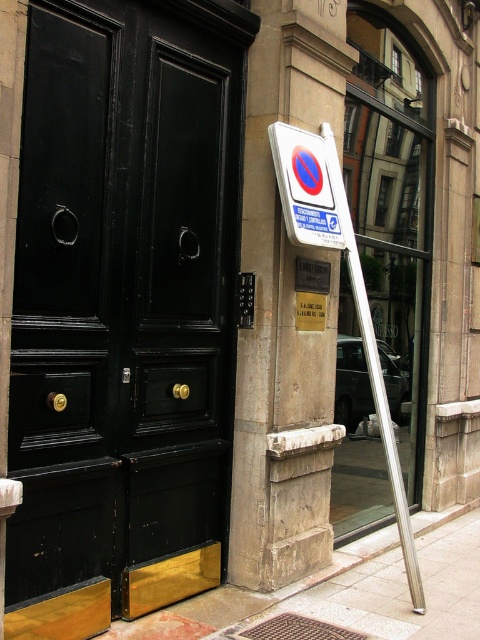
Question: Which point is closer to the camera taking this photo?

Choices:
 (A) (335, 152)
 (B) (312, 243)
 (C) (310, 42)
 (D) (20, 449)

Answer: (D)

Question: Does stone pillar at center have a greater width compared to smooth concrete sidewalk at lower center?

Choices:
 (A) no
 (B) yes

Answer: (A)

Question: Can you confirm if black polished wood door at center is positioned to the right of smooth concrete sidewalk at lower center?

Choices:
 (A) yes
 (B) no

Answer: (B)

Question: Which point is farther from the camera taking this photo?

Choices:
 (A) (81, 536)
 (B) (283, 182)
 (C) (432, 602)

Answer: (C)

Question: Which of the following is the closest to the observer?

Choices:
 (A) (326, 401)
 (B) (264, 618)
 (C) (70, 305)
 (D) (344, 193)

Answer: (C)

Question: Is black polished wood door at center thinner than smooth concrete sidewalk at lower center?

Choices:
 (A) no
 (B) yes

Answer: (B)